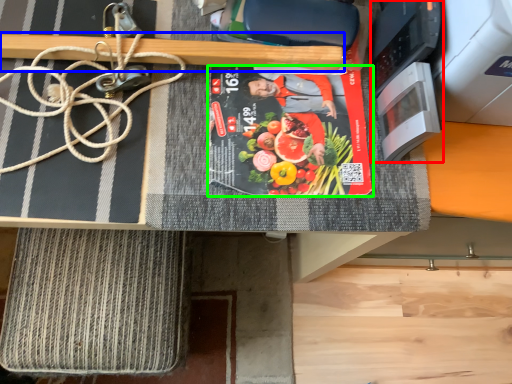
Question: Considering the real-world distances, which object is farthest from appliance (highlighted by a red box)? wood (highlighted by a blue box) or paperback book (highlighted by a green box)?

Choices:
 (A) wood
 (B) paperback book

Answer: (A)